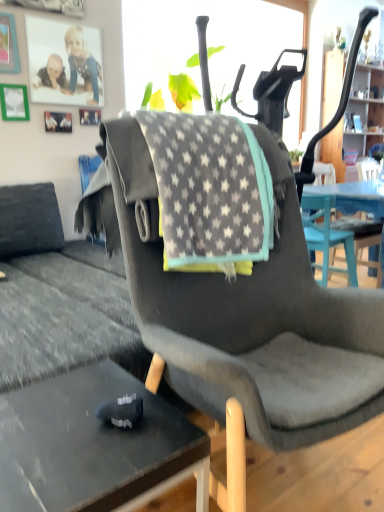
Image resolution: width=384 pixels, height=512 pixels. I want to click on free space above black glass desk at lower left (from a real-world perspective), so click(x=84, y=419).